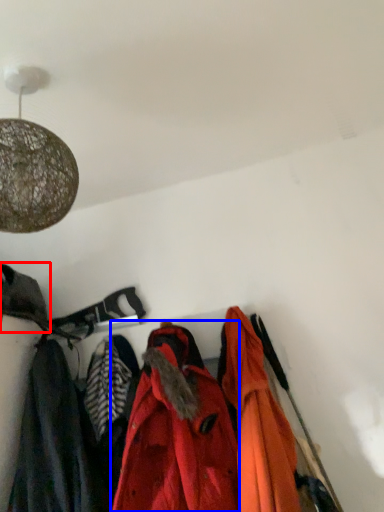
Question: Which object is closer to the camera taking this photo, cloak (highlighted by a red box) or jacket (highlighted by a blue box)?

Choices:
 (A) cloak
 (B) jacket

Answer: (B)